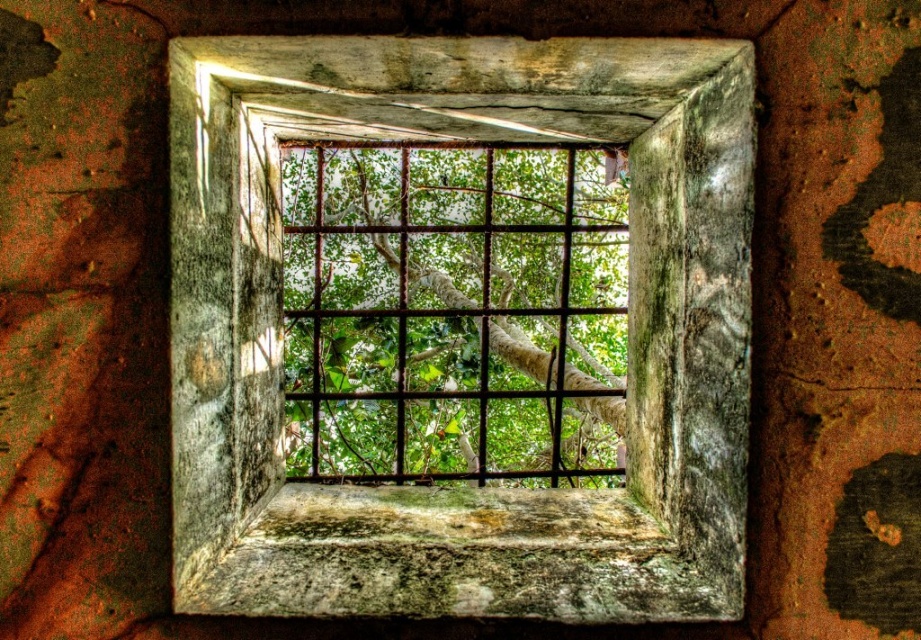
Can you confirm if rusty metal window frame at center is positioned above green leafy tree at center?

No, rusty metal window frame at center is not above green leafy tree at center.

Is point (719, 51) positioned in front of point (375, 339)?

Yes, it is in front of point (375, 339).

Where is `rusty metal window frame at center`? rusty metal window frame at center is located at coordinates (462, 490).